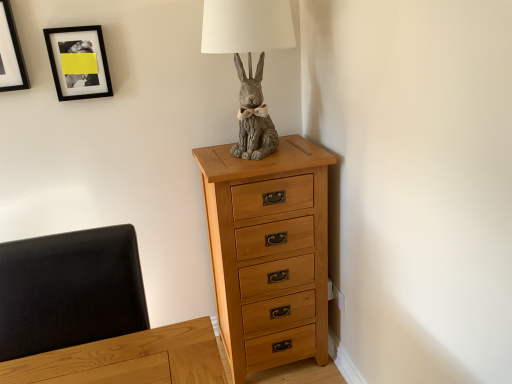
Question: Could matte black picture frame at upper left, arranged as the second picture frame when viewed from the right, be considered to be inside gray stone rabbit at center?

Choices:
 (A) yes
 (B) no

Answer: (B)

Question: Can we say gray stone rabbit at center lies outside matte black picture frame at upper left, which is the first picture frame from left to right?

Choices:
 (A) yes
 (B) no

Answer: (A)

Question: Does gray stone rabbit at center have a greater width compared to matte black picture frame at upper left, arranged as the second picture frame when viewed from the right?

Choices:
 (A) no
 (B) yes

Answer: (B)

Question: Is gray stone rabbit at center touching matte black picture frame at upper left, arranged as the second picture frame when viewed from the right?

Choices:
 (A) yes
 (B) no

Answer: (B)

Question: From the image's perspective, would you say gray stone rabbit at center is positioned over matte black picture frame at upper left, which is the first picture frame from left to right?

Choices:
 (A) no
 (B) yes

Answer: (A)

Question: Does gray stone rabbit at center have a smaller size compared to matte black picture frame at upper left, arranged as the second picture frame when viewed from the right?

Choices:
 (A) yes
 (B) no

Answer: (B)

Question: Is black leather swivel chair at left oriented away from matte black picture frame at upper left, which is the first picture frame from left to right?

Choices:
 (A) no
 (B) yes

Answer: (A)

Question: From a real-world perspective, is black leather swivel chair at left over matte black picture frame at upper left, which is the first picture frame from left to right?

Choices:
 (A) yes
 (B) no

Answer: (B)

Question: Considering the relative sizes of black leather swivel chair at left and matte black picture frame at upper left, arranged as the second picture frame when viewed from the right, in the image provided, is black leather swivel chair at left thinner than matte black picture frame at upper left, arranged as the second picture frame when viewed from the right,?

Choices:
 (A) no
 (B) yes

Answer: (A)

Question: Considering the relative sizes of black leather swivel chair at left and matte black picture frame at upper left, arranged as the second picture frame when viewed from the right, in the image provided, is black leather swivel chair at left bigger than matte black picture frame at upper left, arranged as the second picture frame when viewed from the right,?

Choices:
 (A) no
 (B) yes

Answer: (B)

Question: Can matte black picture frame at upper left, arranged as the second picture frame when viewed from the right, be found inside black leather swivel chair at left?

Choices:
 (A) no
 (B) yes

Answer: (A)

Question: Does black leather swivel chair at left touch matte black picture frame at upper left, which is the first picture frame from left to right?

Choices:
 (A) no
 (B) yes

Answer: (A)

Question: Is gray stone rabbit at center to the right of black leather swivel chair at left from the viewer's perspective?

Choices:
 (A) no
 (B) yes

Answer: (B)